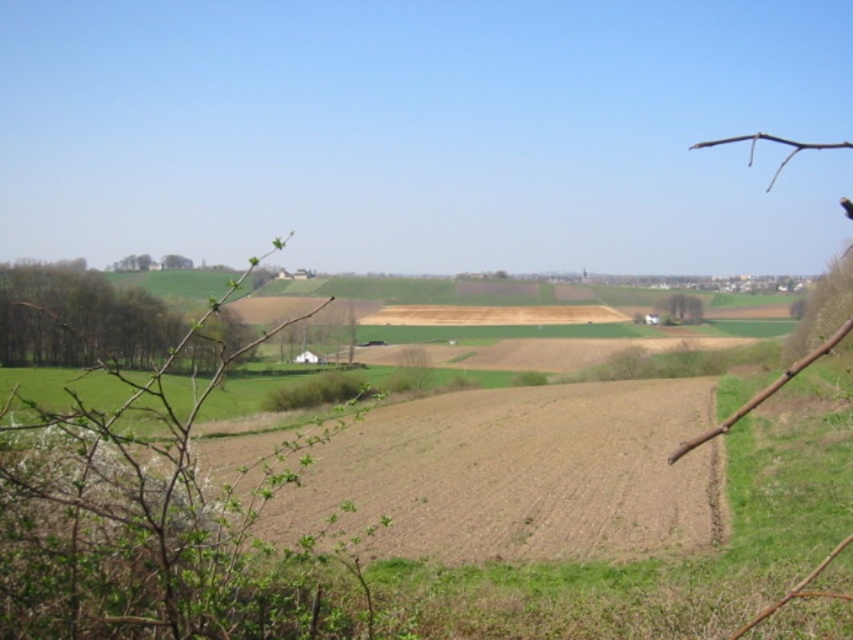
Which is below, brown soil at center or green leafy tree at right?

brown soil at center is below.

Can you confirm if brown soil at center is positioned to the left of green leafy tree at right?

Correct, you'll find brown soil at center to the left of green leafy tree at right.

Describe the element at coordinates (518, 474) in the screenshot. I see `brown soil at center` at that location.

The image size is (853, 640). In order to click on brown soil at center in this screenshot , I will do `click(518, 474)`.

Does green leafy branch at left have a larger size compared to green leafy tree at right?

Yes.

Looking at this image, is green leafy branch at left closer to camera compared to green leafy tree at right?

That is True.

Describe the element at coordinates (158, 525) in the screenshot. This screenshot has width=853, height=640. I see `green leafy branch at left` at that location.

Locate an element on the screen. The width and height of the screenshot is (853, 640). green leafy branch at left is located at coordinates (158, 525).

Does green leafy branch at left have a greater height compared to brown soil at center?

Correct, green leafy branch at left is much taller as brown soil at center.

Is green leafy branch at left shorter than brown soil at center?

Incorrect, green leafy branch at left's height does not fall short of brown soil at center's.

The image size is (853, 640). Describe the element at coordinates (158, 525) in the screenshot. I see `green leafy branch at left` at that location.

Identify the location of green leafy branch at left. (158, 525).